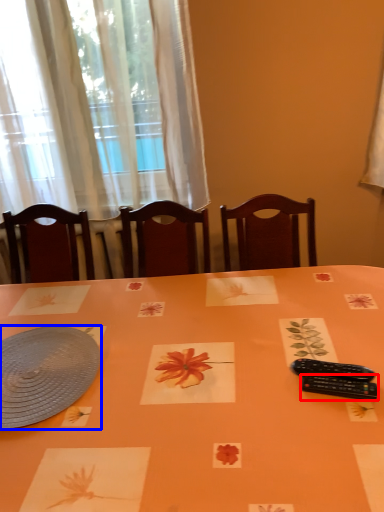
Question: Which point is further to the camera, control (highlighted by a red box) or platter (highlighted by a blue box)?

Choices:
 (A) control
 (B) platter

Answer: (B)